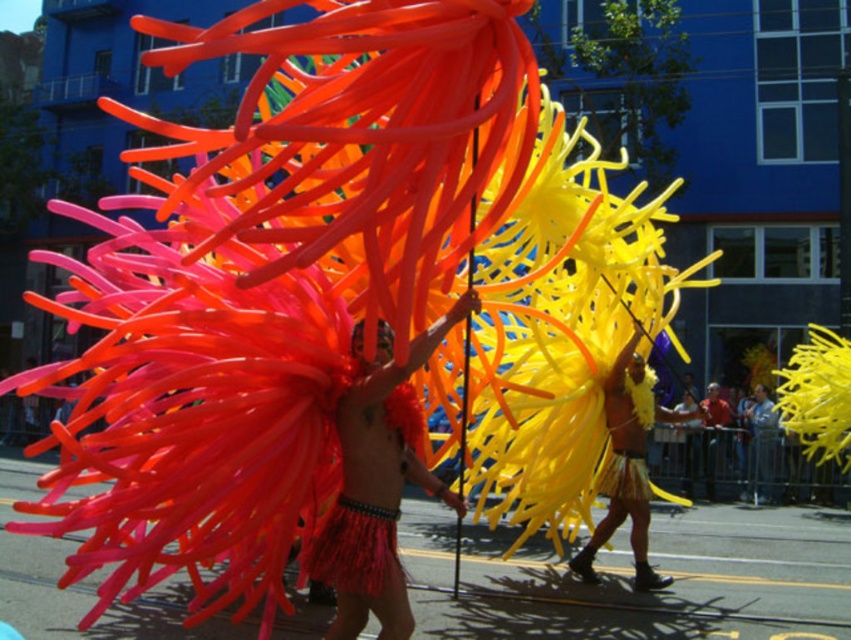
Question: Can you confirm if shiny red feathers at center is positioned above yellow matte/yellowish fabric at center?

Choices:
 (A) yes
 (B) no

Answer: (A)

Question: Based on their relative distances, which object is farther from the yellow matte/yellowish fabric at center?

Choices:
 (A) shiny red feathers at center
 (B) reddish-brown leather jacket at center

Answer: (B)

Question: Considering the real-world distances, which object is closest to the reddish-brown leather jacket at center?

Choices:
 (A) yellow matte/yellowish fabric at center
 (B) shiny red feathers at center

Answer: (A)

Question: Is shiny red feathers at center behind yellow matte/yellowish fabric at center?

Choices:
 (A) yes
 (B) no

Answer: (B)

Question: Does shiny red feathers at center lie behind reddish-brown leather jacket at center?

Choices:
 (A) yes
 (B) no

Answer: (B)

Question: Based on their relative distances, which object is farther from the reddish-brown leather jacket at center?

Choices:
 (A) shiny red feathers at center
 (B) yellow matte/yellowish fabric at center

Answer: (A)